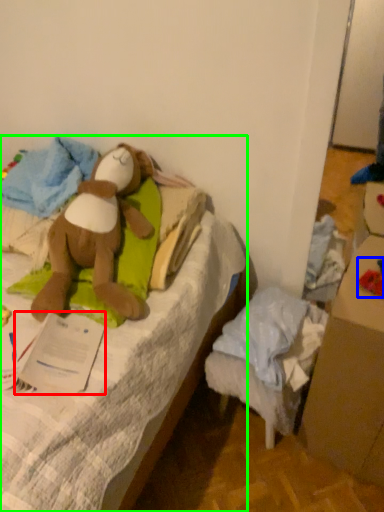
Question: Considering the real-world distances, which object is closest to paper (highlighted by a red box)? toy (highlighted by a blue box) or furniture (highlighted by a green box).

Choices:
 (A) toy
 (B) furniture

Answer: (B)